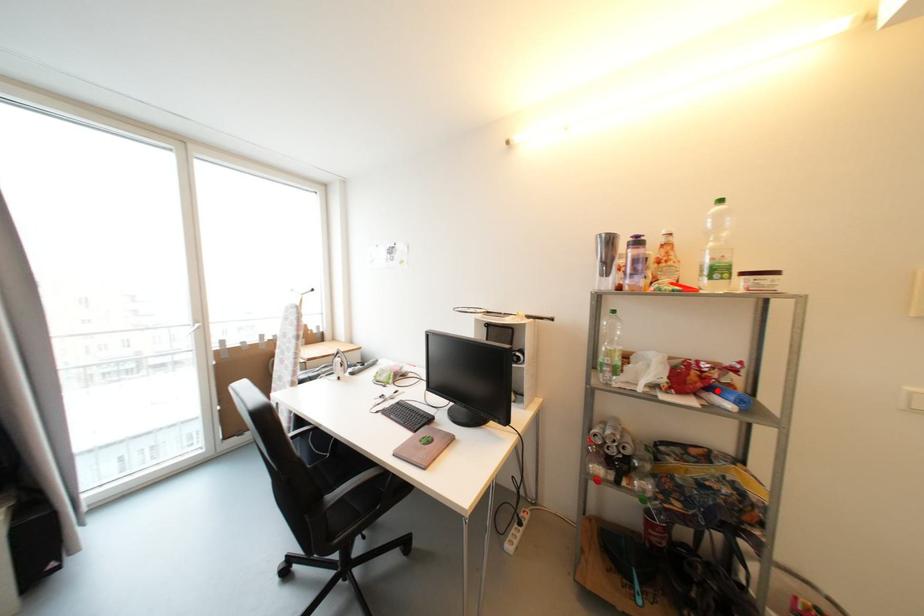
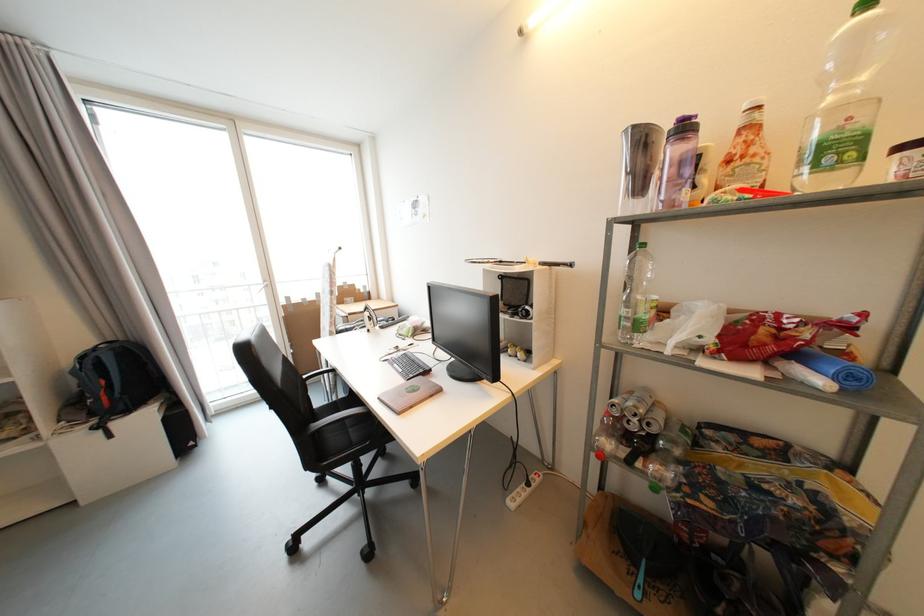
In the second image, find the point that corresponds to the highlighted location in the first image.

(801, 357)